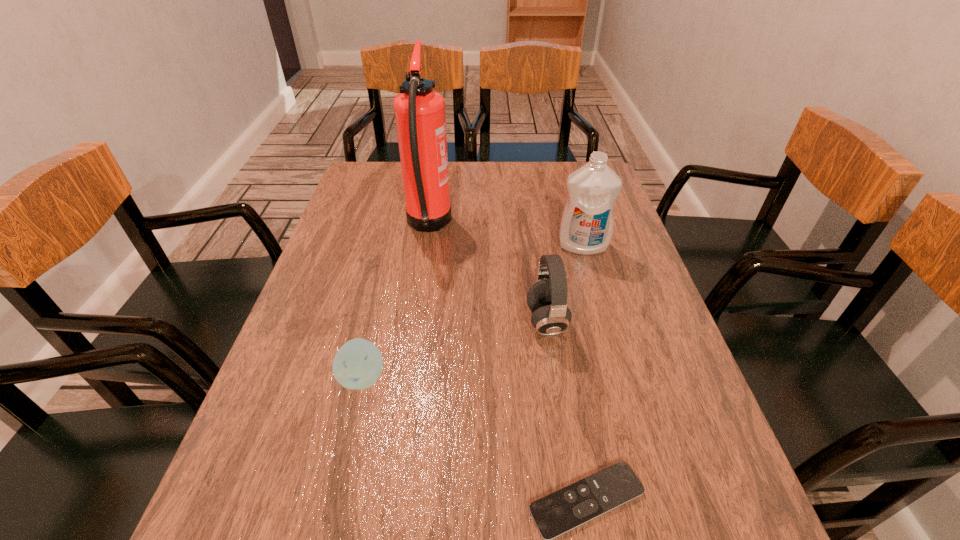
Find the location of a particular element. The height and width of the screenshot is (540, 960). object that is the third closest to the detergent is located at coordinates (358, 364).

Where is `object that is the second closest one to the third nearest object`? object that is the second closest one to the third nearest object is located at coordinates (572, 506).

Find the location of `vacant space that satisfies the following two spatial constraints: 1. at the nozzle of the tallest object; 2. on the left side of the detergent`. vacant space that satisfies the following two spatial constraints: 1. at the nozzle of the tallest object; 2. on the left side of the detergent is located at coordinates (425, 246).

Locate an element on the screen. The width and height of the screenshot is (960, 540). free space that satisfies the following two spatial constraints: 1. on the ear cups of the third nearest object; 2. on the front side of the apple is located at coordinates (555, 377).

The width and height of the screenshot is (960, 540). In order to click on blank space that satisfies the following two spatial constraints: 1. on the back side of the apple; 2. on the right side of the detergent in this screenshot , I will do `click(394, 246)`.

This screenshot has width=960, height=540. Identify the location of free spot that satisfies the following two spatial constraints: 1. on the ear cups of the headset; 2. on the front side of the apple. (555, 377).